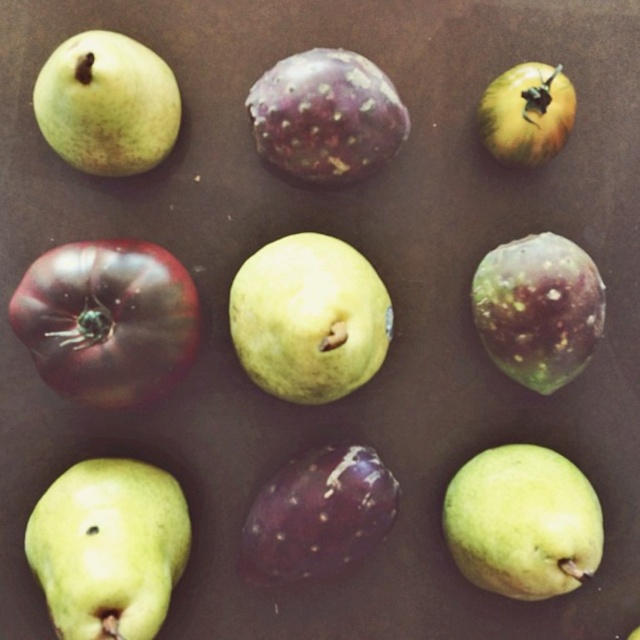
Between green matte pear at center and purple matte fig at center-right, which one is positioned lower?

Positioned lower is green matte pear at center.

Between green matte pear at center and purple matte fig at center-right, which one is positioned higher?

purple matte fig at center-right is higher up.

Who is more forward, (372, 310) or (502, 257)?

Point (372, 310) is in front.

This screenshot has height=640, width=640. I want to click on green matte pear at center, so (308, 317).

Does shiny dark red tomato at center left come behind green matte pear at upper left?

Yes, it is behind green matte pear at upper left.

Does point (76, 337) come closer to viewer compared to point (125, 156)?

Yes, it is.

Does point (97, 273) lie behind point (44, 108)?

No, it is not.

Identify the location of shiny dark red tomato at center left. (108, 320).

Between purple matte fig at center-right and green matte apple at upper right, which one is positioned higher?

Positioned higher is green matte apple at upper right.

Which is more to the left, purple matte fig at center-right or green matte apple at upper right?

From the viewer's perspective, green matte apple at upper right appears more on the left side.

At what (x,y) coordinates should I click in order to perform the action: click on purple matte fig at center-right. Please return your answer as a coordinate pair (x, y). Looking at the image, I should click on (538, 308).